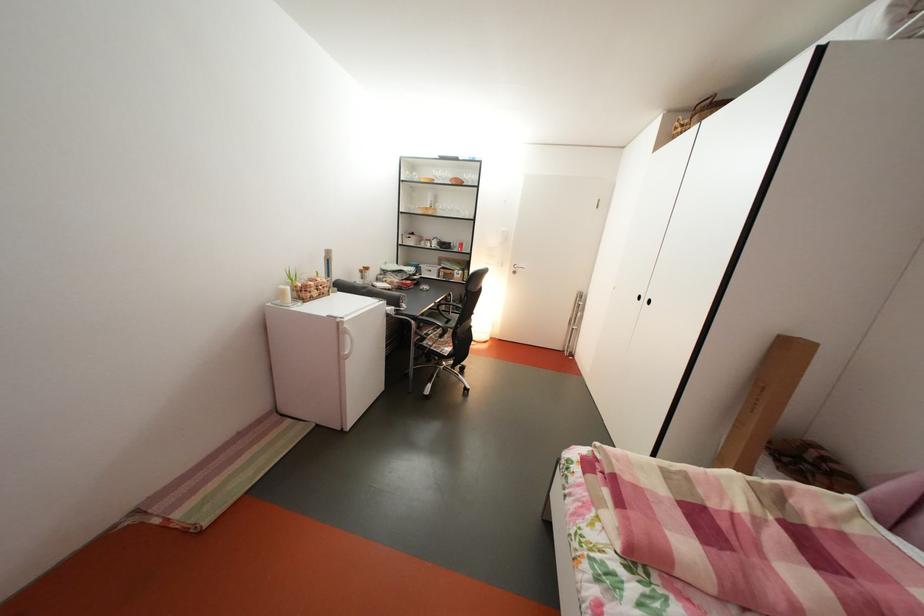
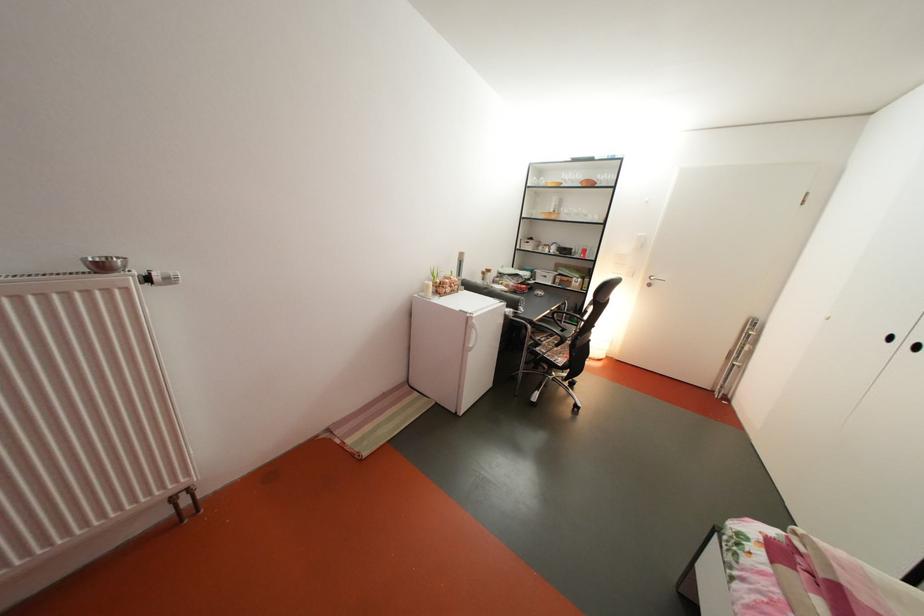
Question: I am providing you with two images of the same scene from different viewpoints. Which of the following objects are not visible in image2?

Choices:
 (A) black chair armrest
 (B) black wardrobe handle
 (C) radiator thermostat knob
 (D) none of these

Answer: (D)